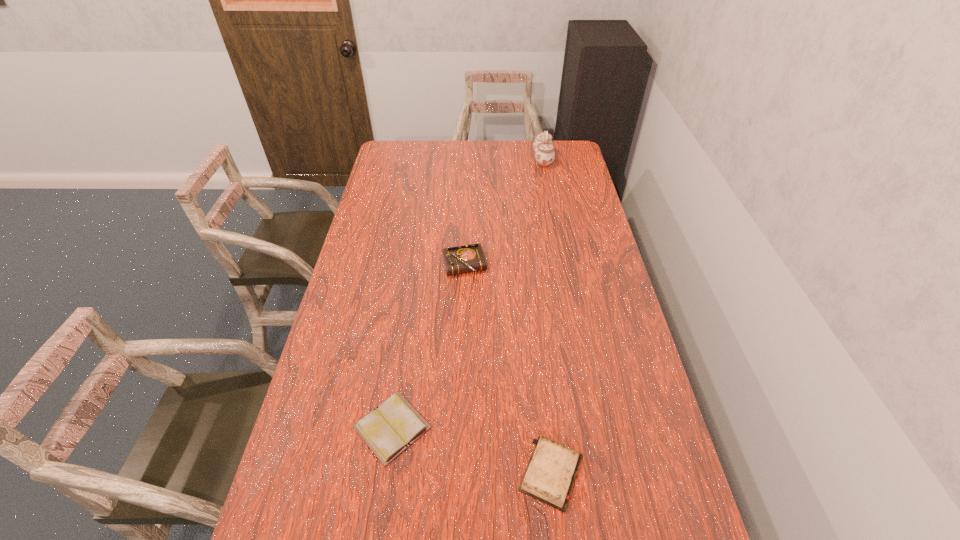
Where is `free spot located on the front of the farthest diary`? The height and width of the screenshot is (540, 960). free spot located on the front of the farthest diary is located at coordinates (464, 292).

Locate an element on the screen. vacant space located on the back of the second tallest diary is located at coordinates (534, 321).

Find the location of `vacant area located 0.320m on the right of the shortest object`. vacant area located 0.320m on the right of the shortest object is located at coordinates (556, 427).

At what (x,y) coordinates should I click in order to perform the action: click on object located in the far edge section of the desktop. Please return your answer as a coordinate pair (x, y). Looking at the image, I should click on (543, 146).

At what (x,y) coordinates should I click in order to perform the action: click on object that is positioned at the left edge. Please return your answer as a coordinate pair (x, y). Looking at the image, I should click on (394, 425).

This screenshot has width=960, height=540. I want to click on object that is at the right edge, so click(x=543, y=146).

At what (x,y) coordinates should I click in order to perform the action: click on object at the far right corner. Please return your answer as a coordinate pair (x, y). Looking at the image, I should click on (543, 146).

What are the coordinates of `vacant space at the far edge of the desktop` in the screenshot? It's located at (454, 164).

The height and width of the screenshot is (540, 960). I want to click on free location at the left edge, so click(x=360, y=377).

The image size is (960, 540). Identify the location of vacant area at the right edge. (646, 379).